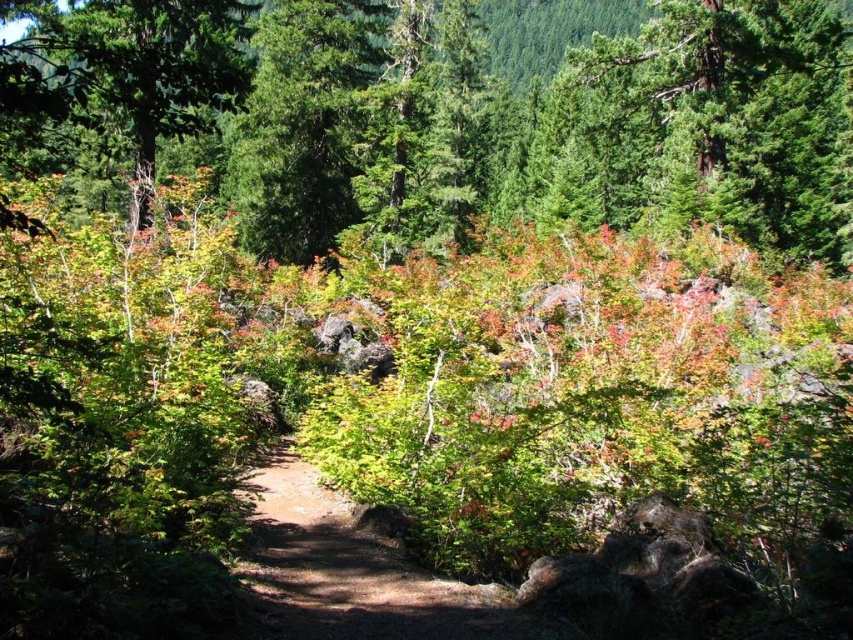
Question: From the image, what is the correct spatial relationship of green matte tree at upper center in relation to green matte tree at upper left?

Choices:
 (A) above
 (B) below

Answer: (A)

Question: Does green matte tree at upper center have a greater width compared to dirt path at center?

Choices:
 (A) no
 (B) yes

Answer: (B)

Question: Which of the following is the closest to the observer?

Choices:
 (A) dirt path at center
 (B) green matte tree at upper center

Answer: (B)

Question: Among these points, which one is nearest to the camera?

Choices:
 (A) (169, 93)
 (B) (459, 628)
 (C) (654, 54)

Answer: (A)

Question: Estimate the real-world distances between objects in this image. Which object is farther from the green matte tree at upper center?

Choices:
 (A) dirt path at center
 (B) green matte tree at upper left

Answer: (A)

Question: Is green matte tree at upper center further to the viewer compared to green matte tree at upper left?

Choices:
 (A) no
 (B) yes

Answer: (A)